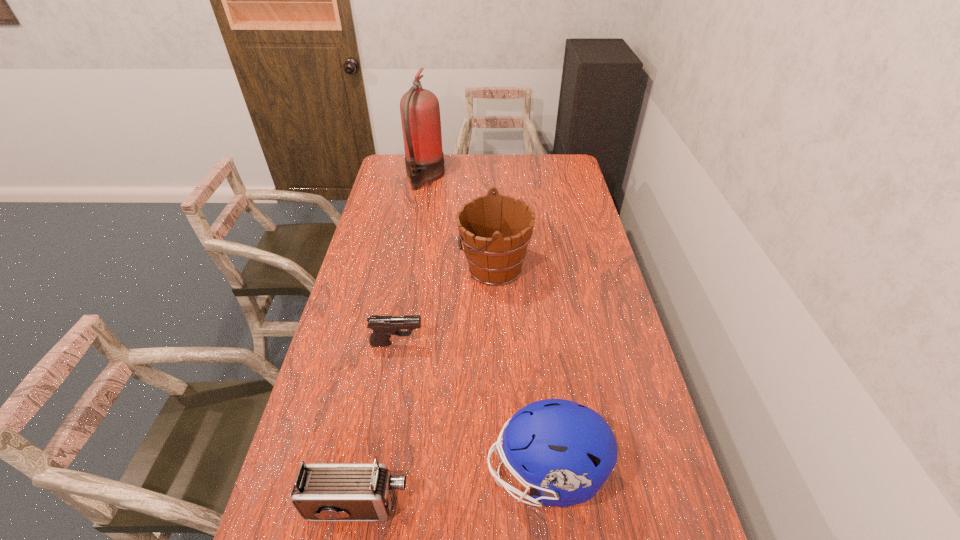
Image resolution: width=960 pixels, height=540 pixels. In order to click on object that is positioned at the right edge in this screenshot , I will do `click(566, 451)`.

Find the location of a particular element. object that is at the far left corner is located at coordinates (420, 113).

Where is `vacant space at the far edge`? vacant space at the far edge is located at coordinates click(527, 171).

Find the location of `vacant region at the left edge of the desktop`. vacant region at the left edge of the desktop is located at coordinates (382, 210).

At what (x,y) coordinates should I click in order to perform the action: click on vacant space at the right edge of the desktop. Please return your answer as a coordinate pair (x, y). Looking at the image, I should click on (581, 346).

I want to click on free location at the far right corner, so [558, 175].

Where is `vacant space that is in between the second farthest object and the fourth tallest object`? This screenshot has height=540, width=960. vacant space that is in between the second farthest object and the fourth tallest object is located at coordinates click(426, 386).

This screenshot has height=540, width=960. In order to click on free space that is in between the fire extinguisher and the third farthest object in this screenshot , I will do `click(411, 260)`.

Where is `free space between the camcorder and the football helmet`? This screenshot has width=960, height=540. free space between the camcorder and the football helmet is located at coordinates (451, 489).

The image size is (960, 540). Find the location of `empty location between the pistol and the camcorder`. empty location between the pistol and the camcorder is located at coordinates (377, 424).